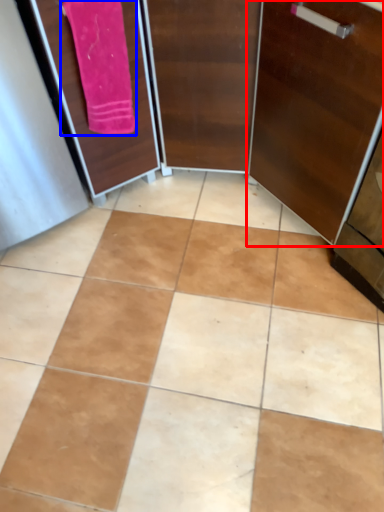
Question: Among these objects, which one is nearest to the camera, door (highlighted by a red box) or bath towel (highlighted by a blue box)?

Choices:
 (A) door
 (B) bath towel

Answer: (A)